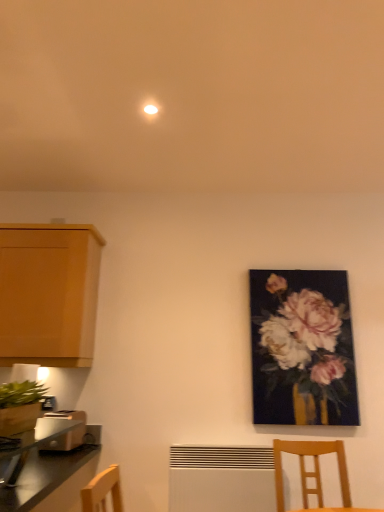
Question: Can you confirm if wooden chair at lower right is positioned to the left of metallic silver toaster at lower left?

Choices:
 (A) no
 (B) yes

Answer: (A)

Question: Can you confirm if wooden chair at lower right is bigger than metallic silver toaster at lower left?

Choices:
 (A) yes
 (B) no

Answer: (A)

Question: Can you confirm if wooden chair at lower right is wider than metallic silver toaster at lower left?

Choices:
 (A) yes
 (B) no

Answer: (A)

Question: From a real-world perspective, is wooden chair at lower right positioned under metallic silver toaster at lower left based on gravity?

Choices:
 (A) no
 (B) yes

Answer: (B)

Question: Can you confirm if wooden chair at lower right is smaller than metallic silver toaster at lower left?

Choices:
 (A) no
 (B) yes

Answer: (A)

Question: Can you confirm if wooden chair at lower right is thinner than metallic silver toaster at lower left?

Choices:
 (A) no
 (B) yes

Answer: (A)

Question: Does wooden cabinet at left have a larger size compared to white matte radiator at lower center?

Choices:
 (A) no
 (B) yes

Answer: (B)

Question: Considering the relative positions of wooden cabinet at left and white matte radiator at lower center in the image provided, is wooden cabinet at left to the left of white matte radiator at lower center from the viewer's perspective?

Choices:
 (A) no
 (B) yes

Answer: (B)

Question: Is wooden cabinet at left turned away from white matte radiator at lower center?

Choices:
 (A) yes
 (B) no

Answer: (B)

Question: Can you confirm if wooden cabinet at left is shorter than white matte radiator at lower center?

Choices:
 (A) yes
 (B) no

Answer: (B)

Question: From the image's perspective, is wooden cabinet at left beneath white matte radiator at lower center?

Choices:
 (A) yes
 (B) no

Answer: (B)

Question: Can you confirm if wooden cabinet at left is taller than white matte radiator at lower center?

Choices:
 (A) no
 (B) yes

Answer: (B)

Question: Is there a large distance between metallic silver toaster at lower left and light brown plastic toaster at lower left?

Choices:
 (A) no
 (B) yes

Answer: (A)